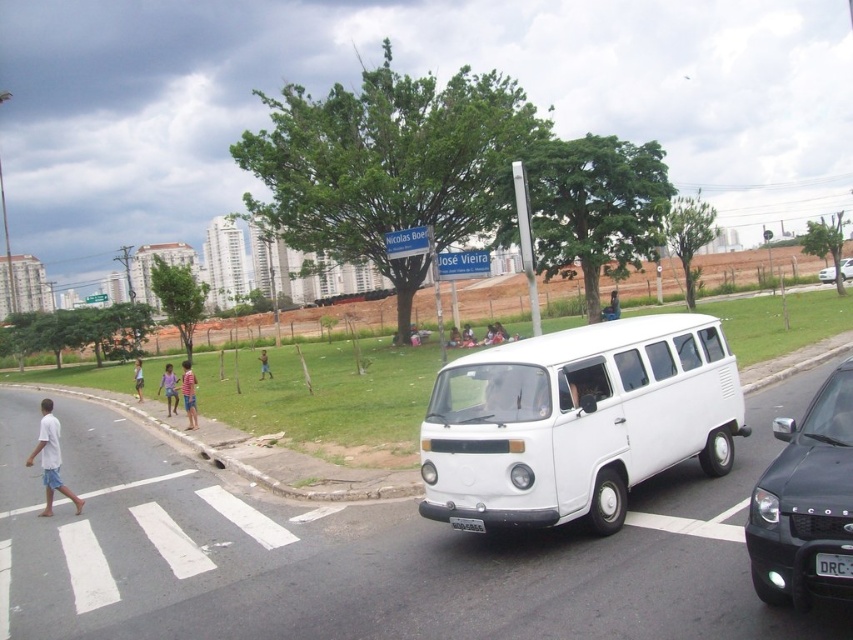
You are a pedestrian standing at the edge of the road. You see a dark brown leather jacket at center. Where is the jacket positioned relative to the white Volkswagen Kombi van?

The dark brown leather jacket at center is located at point 0.481 on the x axis and 0.717 on the y axis relative to the white Volkswagen Kombi van.